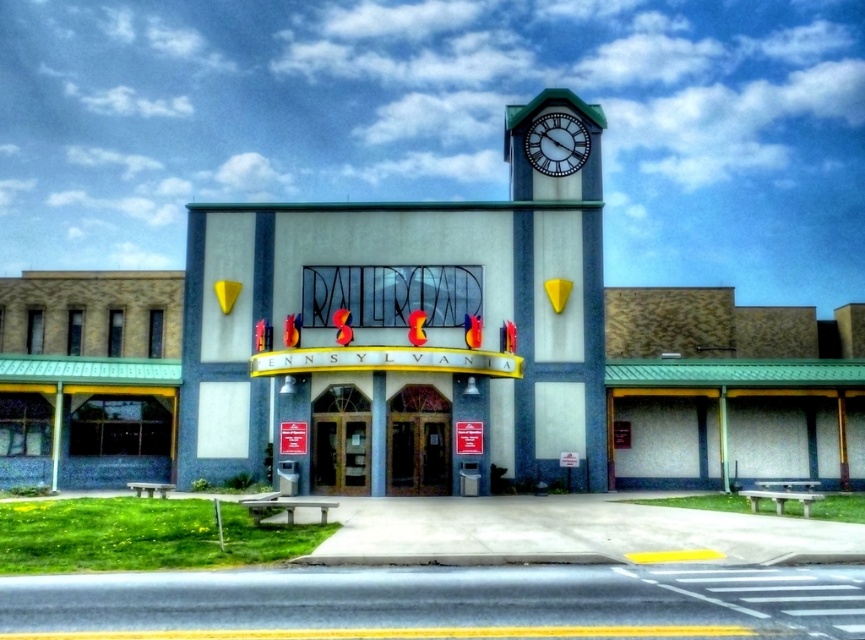
Does green matte bench at lower right have a greater height compared to white glossy clock at upper center?

No.

Which is behind, point (853, 451) or point (584, 145)?

The point (584, 145) is behind.

The width and height of the screenshot is (865, 640). In order to click on green matte bench at lower right in this screenshot , I will do `click(735, 420)`.

The height and width of the screenshot is (640, 865). In order to click on white painted concrete clock tower at upper right in this screenshot , I will do `click(556, 278)`.

Who is more forward, (x=516, y=140) or (x=555, y=172)?

Point (x=555, y=172) is in front.

Find the location of `white painted concrete clock tower at upper right`. white painted concrete clock tower at upper right is located at coordinates (556, 278).

Who is positioned more to the left, white painted concrete clock tower at upper right or green matte bench at lower right?

white painted concrete clock tower at upper right

The height and width of the screenshot is (640, 865). What do you see at coordinates (556, 278) in the screenshot?
I see `white painted concrete clock tower at upper right` at bounding box center [556, 278].

Locate an element on the screen. white painted concrete clock tower at upper right is located at coordinates (556, 278).